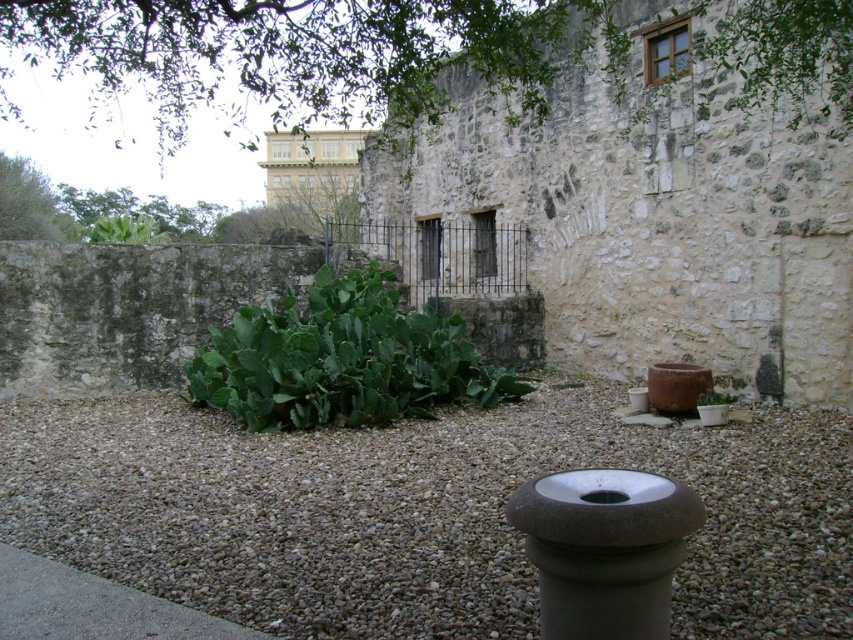
Is gray gravel at center to the right of green leafy cactus at upper center from the viewer's perspective?

Yes, gray gravel at center is to the right of green leafy cactus at upper center.

Which of these two, gray gravel at center or green leafy cactus at upper center, stands shorter?

With less height is gray gravel at center.

The height and width of the screenshot is (640, 853). I want to click on gray gravel at center, so click(x=421, y=512).

Is green leafy cactus at upper center taller than green leafy cactus at center?

Correct, green leafy cactus at upper center is much taller as green leafy cactus at center.

Which of these two, green leafy cactus at upper center or green leafy cactus at center, stands shorter?

green leafy cactus at center

Between point (368, 68) and point (387, 304), which one is positioned behind?

The point (387, 304) is more distant.

This screenshot has height=640, width=853. I want to click on green leafy cactus at upper center, so click(311, 52).

Which is behind, point (125, 573) or point (316, 417)?

Point (316, 417)

How much distance is there between gray gravel at center and green leafy cactus at center?

gray gravel at center and green leafy cactus at center are 5.36 meters apart from each other.

Is point (491, 516) farther from viewer compared to point (393, 294)?

No.

The image size is (853, 640). I want to click on gray gravel at center, so click(421, 512).